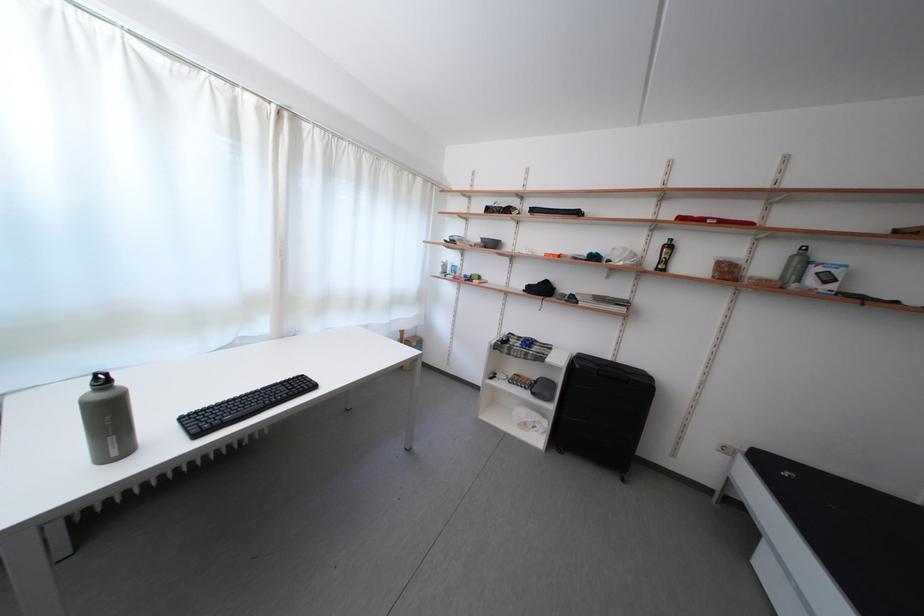
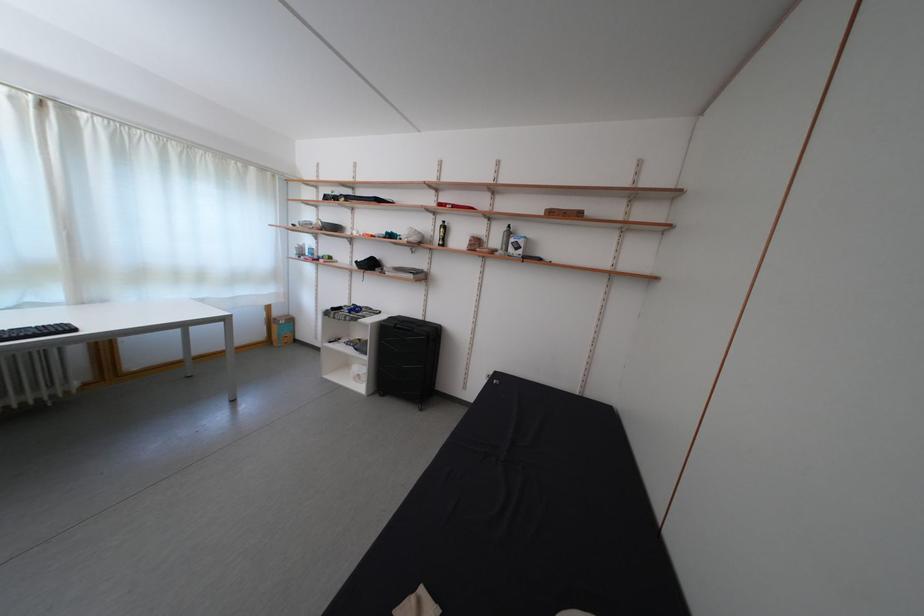
The point at (416,341) is marked in the first image. Where is the corresponding point in the second image?

(285, 320)